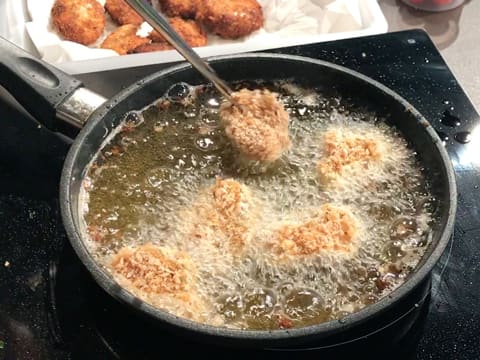
I want to click on draining dish, so click(x=377, y=26).